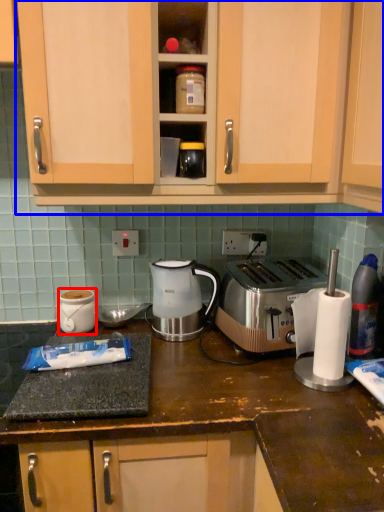
Question: Which point is further to the camera, appliance (highlighted by a red box) or cabinetry (highlighted by a blue box)?

Choices:
 (A) appliance
 (B) cabinetry

Answer: (A)